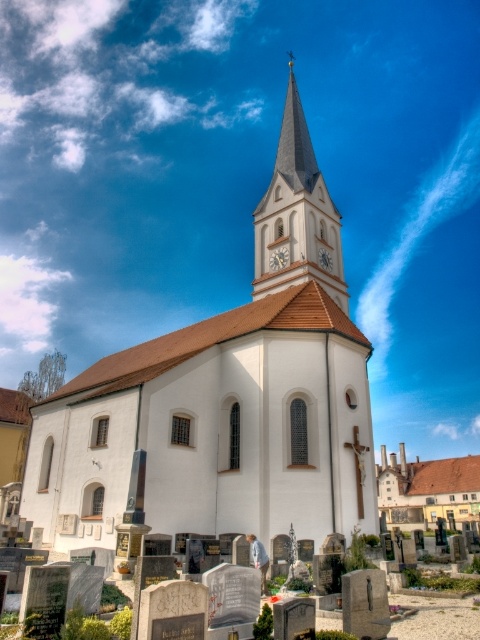
Question: Does smooth gray steeple at center appear on the left side of brown tiled roof at center?

Choices:
 (A) yes
 (B) no

Answer: (A)

Question: Which of these objects is positioned closest to the smooth gray steeple at center?

Choices:
 (A) white matte church at center
 (B) marble gravestones at lower center
 (C) white wooden clock at center

Answer: (C)

Question: Which of these objects is positioned closest to the white wooden clock at center?

Choices:
 (A) smooth gray stone gravestone at lower center
 (B) white matte church at center
 (C) brown tiled roof at center

Answer: (B)

Question: Which of the following is the closest to the observer?

Choices:
 (A) (460, 516)
 (B) (315, 541)

Answer: (B)

Question: Can you confirm if smooth gray steeple at center is positioned above white wooden clock at center?

Choices:
 (A) no
 (B) yes

Answer: (B)

Question: Does metallic clock face at center appear on the left side of white wooden clock at center?

Choices:
 (A) no
 (B) yes

Answer: (B)